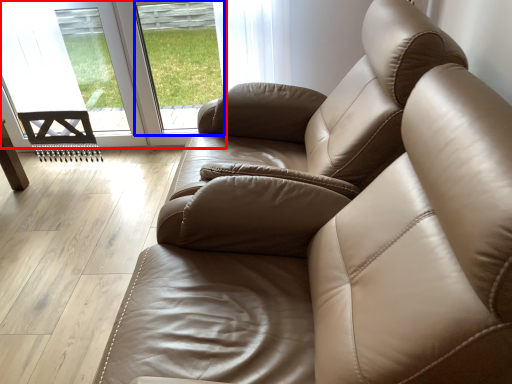
Question: Which object appears farthest to the camera in this image, glass door (highlighted by a red box) or window (highlighted by a blue box)?

Choices:
 (A) glass door
 (B) window

Answer: (A)